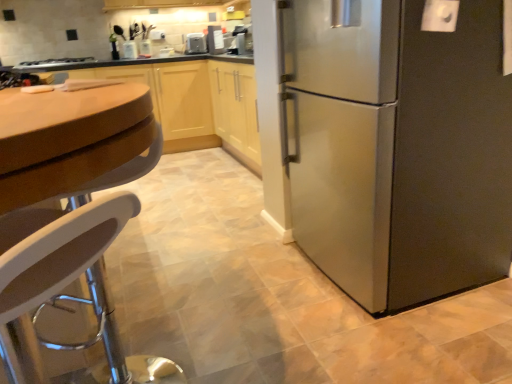
Question: From the image's perspective, is white plastic stool at lower left below wooden cabinet at center?

Choices:
 (A) yes
 (B) no

Answer: (A)

Question: Is white plastic stool at lower left far from wooden cabinet at center?

Choices:
 (A) yes
 (B) no

Answer: (A)

Question: Is white plastic stool at lower left at the left side of wooden cabinet at center?

Choices:
 (A) yes
 (B) no

Answer: (B)

Question: Can you confirm if white plastic stool at lower left is wider than wooden cabinet at center?

Choices:
 (A) no
 (B) yes

Answer: (A)

Question: Could wooden cabinet at center be considered to be inside white plastic stool at lower left?

Choices:
 (A) no
 (B) yes

Answer: (A)

Question: Is white plastic stool at lower left thinner than wooden cabinet at center?

Choices:
 (A) no
 (B) yes

Answer: (B)

Question: From the image's perspective, does satin silver stove at upper left appear lower than satin silver refrigerator at right?

Choices:
 (A) no
 (B) yes

Answer: (A)

Question: Can satin silver refrigerator at right be found inside satin silver stove at upper left?

Choices:
 (A) yes
 (B) no

Answer: (B)

Question: Considering the relative sizes of satin silver stove at upper left and satin silver refrigerator at right in the image provided, is satin silver stove at upper left wider than satin silver refrigerator at right?

Choices:
 (A) no
 (B) yes

Answer: (A)

Question: Is satin silver stove at upper left taller than satin silver refrigerator at right?

Choices:
 (A) yes
 (B) no

Answer: (B)

Question: Can we say satin silver stove at upper left lies outside satin silver refrigerator at right?

Choices:
 (A) yes
 (B) no

Answer: (A)

Question: Is satin silver stove at upper left placed right next to satin silver refrigerator at right?

Choices:
 (A) yes
 (B) no

Answer: (B)

Question: Does wooden cabinet at center lie behind metallic silver toaster at upper center, arranged as the first appliance when viewed from the back?

Choices:
 (A) yes
 (B) no

Answer: (B)